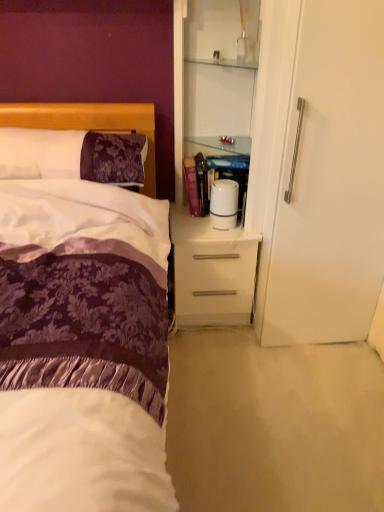
What do you see at coordinates (212, 271) in the screenshot? The image size is (384, 512). I see `white glossy nightstand at center` at bounding box center [212, 271].

Describe the element at coordinates (212, 76) in the screenshot. I see `white glossy cabinet at upper right` at that location.

In the scene shown: What is the approximate width of white glossy cabinet at upper right?

white glossy cabinet at upper right is 39.50 centimeters wide.

Where is `purple damask pillow at left`? This screenshot has height=512, width=384. purple damask pillow at left is located at coordinates (73, 155).

Is purple damask pillow at left smaller than white glossy cabinet at upper right?

Correct, purple damask pillow at left occupies less space than white glossy cabinet at upper right.

Which is closer, (11, 133) or (238, 36)?

Point (11, 133) appears to be closer to the viewer than point (238, 36).

Is purple damask pillow at left next to white glossy cabinet at upper right?

No, purple damask pillow at left is not next to white glossy cabinet at upper right.

Consider the image. Considering the relative sizes of purple damask pillow at left and white glossy cabinet at upper right in the image provided, is purple damask pillow at left shorter than white glossy cabinet at upper right?

Yes, purple damask pillow at left is shorter than white glossy cabinet at upper right.

Which is closer, (198,128) or (57,151)?

Positioned in front is point (57,151).

The width and height of the screenshot is (384, 512). I want to click on cabinetry on the right side of purple damask pillow at left, so click(x=212, y=76).

In terms of width, does white glossy cabinet at upper right look wider or thinner when compared to purple damask pillow at left?

Clearly, white glossy cabinet at upper right has less width compared to purple damask pillow at left.

From the image's perspective, who appears lower, purple damask pillow at left or white glossy nightstand at center?

white glossy nightstand at center is shown below in the image.

Which is in front, point (5, 139) or point (221, 271)?

Positioned in front is point (5, 139).

Considering the sizes of objects purple damask pillow at left and white glossy nightstand at center in the image provided, who is smaller, purple damask pillow at left or white glossy nightstand at center?

Smaller between the two is purple damask pillow at left.

Would you say white glossy nightstand at center is a long distance from purple damask pillow at left?

white glossy nightstand at center is actually quite close to purple damask pillow at left.

Which is less distant, (238, 258) or (26, 149)?

Point (238, 258) appears to be farther away from the viewer than point (26, 149).

Between white glossy nightstand at center and purple damask pillow at left, which one is positioned in front?

purple damask pillow at left.

I want to click on pillow in front of the white glossy nightstand at center, so click(x=73, y=155).

Which of these two, white glossy cabinet at upper right or white glossy nightstand at center, is thinner?

white glossy cabinet at upper right is thinner.

Considering the positions of objects white glossy cabinet at upper right and white glossy nightstand at center in the image provided, who is in front, white glossy cabinet at upper right or white glossy nightstand at center?

white glossy cabinet at upper right is closer to the camera.

Considering the sizes of objects white glossy cabinet at upper right and white glossy nightstand at center in the image provided, who is bigger, white glossy cabinet at upper right or white glossy nightstand at center?

With larger size is white glossy cabinet at upper right.

Is white glossy cabinet at upper right shorter than white glossy nightstand at center?

Incorrect, the height of white glossy cabinet at upper right does not fall short of that of white glossy nightstand at center.

Between white glossy nightstand at center and white glossy cabinet at upper right, which one has smaller size?

white glossy nightstand at center is smaller.

Does white glossy nightstand at center come behind white glossy cabinet at upper right?

Yes, the depth of white glossy nightstand at center is greater than that of white glossy cabinet at upper right.

Can you tell me how much white glossy nightstand at center and white glossy cabinet at upper right differ in facing direction?

They differ by 1.45 degrees in their facing directions.

Does white glossy nightstand at center appear on the right side of white glossy cabinet at upper right?

In fact, white glossy nightstand at center is to the left of white glossy cabinet at upper right.

Where is `pillow to the left of white glossy cabinet at upper right`? The height and width of the screenshot is (512, 384). pillow to the left of white glossy cabinet at upper right is located at coordinates (73, 155).

Locate an element on the screen. cabinetry to the right of purple damask pillow at left is located at coordinates (212, 76).

Which object lies nearer to the anchor point white glossy cabinet at upper right, white glossy nightstand at center or purple damask pillow at left?

white glossy nightstand at center lies closer to white glossy cabinet at upper right than the other object.

Based on the photo, looking at the image, which one is located further to purple damask pillow at left, white glossy nightstand at center or white glossy cabinet at upper right?

A: The object further to purple damask pillow at left is white glossy nightstand at center.

Looking at the image, which one is located closer to white glossy nightstand at center, purple damask pillow at left or white glossy cabinet at upper right?

Among the two, white glossy cabinet at upper right is located nearer to white glossy nightstand at center.

Estimate the real-world distances between objects in this image. Which object is further from white glossy nightstand at center, white glossy cabinet at upper right or purple damask pillow at left?

Based on the image, purple damask pillow at left appears to be further to white glossy nightstand at center.

From the image, which object appears to be nearer to white glossy cabinet at upper right, purple damask pillow at left or white glossy nightstand at center?

white glossy nightstand at center is positioned closer to the anchor white glossy cabinet at upper right.

When comparing their distances from purple damask pillow at left, does white glossy cabinet at upper right or white glossy nightstand at center seem further?

Among the two, white glossy nightstand at center is located further to purple damask pillow at left.

Locate an element on the screen. The height and width of the screenshot is (512, 384). desk located between purple damask pillow at left and white glossy cabinet at upper right in the left-right direction is located at coordinates (212, 271).